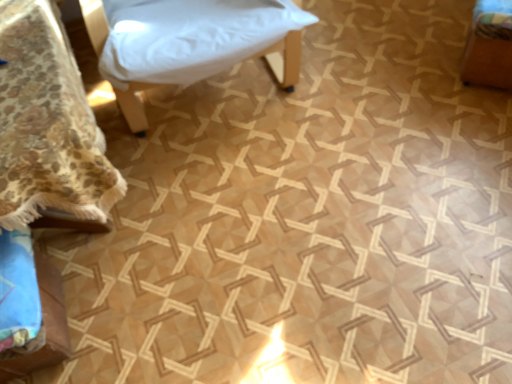
What is the approximate height of floral fabric bedspread at lower left, which ranks as the first furniture in left-to-right order?

It is 24.24 inches.

Measure the distance between wooden box at right, which appears as the first furniture when viewed from the right, and camera.

wooden box at right, which appears as the first furniture when viewed from the right, and camera are 1.35 meters apart.

What is the approximate height of blue fabric cushion at lower left, which is the 2th furniture from left to right?

35.86 centimeters.

Identify the location of floral fabric bedspread at lower left, arranged as the fourth furniture when viewed from the right. The image size is (512, 384). (47, 123).

Who is bigger, wooden box at right, which appears as the first furniture when viewed from the right, or white fabric cushion at upper center, which is counted as the second furniture, starting from the right?

white fabric cushion at upper center, which is counted as the second furniture, starting from the right.

How many degrees apart are the facing directions of wooden box at right, acting as the 4th furniture starting from the left, and white fabric cushion at upper center, acting as the third furniture starting from the left?

wooden box at right, acting as the 4th furniture starting from the left, and white fabric cushion at upper center, acting as the third furniture starting from the left, are facing 38.2 degrees away from each other.

Is wooden box at right, acting as the 4th furniture starting from the left, shorter than white fabric cushion at upper center, acting as the third furniture starting from the left?

Indeed, wooden box at right, acting as the 4th furniture starting from the left, has a lesser height compared to white fabric cushion at upper center, acting as the third furniture starting from the left.

Is wooden box at right, which appears as the first furniture when viewed from the right, wider than white fabric cushion at upper center, acting as the third furniture starting from the left?

In fact, wooden box at right, which appears as the first furniture when viewed from the right, might be narrower than white fabric cushion at upper center, acting as the third furniture starting from the left.

From the picture: Does white fabric cushion at upper center, acting as the third furniture starting from the left, turn towards wooden box at right, which appears as the first furniture when viewed from the right?

No, white fabric cushion at upper center, acting as the third furniture starting from the left, is not turned towards wooden box at right, which appears as the first furniture when viewed from the right.

Choose the correct answer: Is white fabric cushion at upper center, which is counted as the second furniture, starting from the right, inside wooden box at right, which appears as the first furniture when viewed from the right, or outside it?

white fabric cushion at upper center, which is counted as the second furniture, starting from the right, lies outside wooden box at right, which appears as the first furniture when viewed from the right.

From a real-world perspective, which object rests below the other?

In real-world perspective, wooden box at right, which appears as the first furniture when viewed from the right, is lower.

Which is in front, point (144, 116) or point (479, 64)?

The point (479, 64) is more forward.

From a real-world perspective, which is physically below, white fabric cushion at upper center, acting as the third furniture starting from the left, or blue fabric cushion at lower left, the 3th furniture from the right?

blue fabric cushion at lower left, the 3th furniture from the right, is physically lower.

Is white fabric cushion at upper center, which is counted as the second furniture, starting from the right, positioned with its back to blue fabric cushion at lower left, the 3th furniture from the right?

That's not correct — white fabric cushion at upper center, which is counted as the second furniture, starting from the right, is not looking away from blue fabric cushion at lower left, the 3th furniture from the right.

Considering the sizes of objects white fabric cushion at upper center, acting as the third furniture starting from the left, and blue fabric cushion at lower left, which is the 2th furniture from left to right, in the image provided, who is wider, white fabric cushion at upper center, acting as the third furniture starting from the left, or blue fabric cushion at lower left, which is the 2th furniture from left to right,?

Wider between the two is white fabric cushion at upper center, acting as the third furniture starting from the left.

Identify the location of the 2nd furniture to the left of the wooden box at right, acting as the 4th furniture starting from the left, counting from the anchor's position. The width and height of the screenshot is (512, 384). (45, 324).

Which is in front, blue fabric cushion at lower left, the 3th furniture from the right, or wooden box at right, which appears as the first furniture when viewed from the right?

blue fabric cushion at lower left, the 3th furniture from the right, is more forward.

From a real-world perspective, is blue fabric cushion at lower left, which is the 2th furniture from left to right, physically above wooden box at right, which appears as the first furniture when viewed from the right?

Actually, blue fabric cushion at lower left, which is the 2th furniture from left to right, is physically below wooden box at right, which appears as the first furniture when viewed from the right, in the real world.

Where is `furniture that is the 2nd object to the left of the wooden box at right, acting as the 4th furniture starting from the left, starting at the anchor`? Image resolution: width=512 pixels, height=384 pixels. furniture that is the 2nd object to the left of the wooden box at right, acting as the 4th furniture starting from the left, starting at the anchor is located at coordinates (45, 324).

From a real-world perspective, relative to blue fabric cushion at lower left, the 3th furniture from the right, is wooden box at right, acting as the 4th furniture starting from the left, vertically above or below?

wooden box at right, acting as the 4th furniture starting from the left, is above blue fabric cushion at lower left, the 3th furniture from the right.

Considering the positions of objects wooden box at right, acting as the 4th furniture starting from the left, and blue fabric cushion at lower left, the 3th furniture from the right, in the image provided, who is in front, wooden box at right, acting as the 4th furniture starting from the left, or blue fabric cushion at lower left, the 3th furniture from the right,?

blue fabric cushion at lower left, the 3th furniture from the right, is closer to the camera.

Considering the sizes of objects floral fabric bedspread at lower left, arranged as the fourth furniture when viewed from the right, and white fabric cushion at upper center, which is counted as the second furniture, starting from the right, in the image provided, who is smaller, floral fabric bedspread at lower left, arranged as the fourth furniture when viewed from the right, or white fabric cushion at upper center, which is counted as the second furniture, starting from the right,?

With smaller size is floral fabric bedspread at lower left, arranged as the fourth furniture when viewed from the right.

Is floral fabric bedspread at lower left, which ranks as the first furniture in left-to-right order, shorter than white fabric cushion at upper center, acting as the third furniture starting from the left?

Yes, floral fabric bedspread at lower left, which ranks as the first furniture in left-to-right order, is shorter than white fabric cushion at upper center, acting as the third furniture starting from the left.

In the image, is floral fabric bedspread at lower left, arranged as the fourth furniture when viewed from the right, positioned in front of or behind white fabric cushion at upper center, acting as the third furniture starting from the left?

Clearly, floral fabric bedspread at lower left, arranged as the fourth furniture when viewed from the right, is in front of white fabric cushion at upper center, acting as the third furniture starting from the left.

Is floral fabric bedspread at lower left, arranged as the fourth furniture when viewed from the right, turned away from white fabric cushion at upper center, acting as the third furniture starting from the left?

No, white fabric cushion at upper center, acting as the third furniture starting from the left, is not at the back of floral fabric bedspread at lower left, arranged as the fourth furniture when viewed from the right.

From a real-world perspective, is blue fabric cushion at lower left, the 3th furniture from the right, below white fabric cushion at upper center, acting as the third furniture starting from the left?

Yes.

Is blue fabric cushion at lower left, the 3th furniture from the right, turned away from white fabric cushion at upper center, acting as the third furniture starting from the left?

No, blue fabric cushion at lower left, the 3th furniture from the right, is not facing away from white fabric cushion at upper center, acting as the third furniture starting from the left.

Consider the image. Is blue fabric cushion at lower left, which is the 2th furniture from left to right, surrounding white fabric cushion at upper center, which is counted as the second furniture, starting from the right?

No, white fabric cushion at upper center, which is counted as the second furniture, starting from the right, is located outside of blue fabric cushion at lower left, which is the 2th furniture from left to right.

Is the surface of blue fabric cushion at lower left, which is the 2th furniture from left to right, in direct contact with white fabric cushion at upper center, which is counted as the second furniture, starting from the right?

No, blue fabric cushion at lower left, which is the 2th furniture from left to right, is not beside white fabric cushion at upper center, which is counted as the second furniture, starting from the right.

Find the location of `the 1st furniture to the left of the wooden box at right, acting as the 4th furniture starting from the left, starting your count from the anchor`. the 1st furniture to the left of the wooden box at right, acting as the 4th furniture starting from the left, starting your count from the anchor is located at coordinates (189, 42).

This screenshot has width=512, height=384. I want to click on furniture on the right of white fabric cushion at upper center, acting as the third furniture starting from the left, so tap(489, 45).

When comparing their distances from wooden box at right, acting as the 4th furniture starting from the left, does blue fabric cushion at lower left, which is the 2th furniture from left to right, or floral fabric bedspread at lower left, arranged as the fourth furniture when viewed from the right, seem closer?

floral fabric bedspread at lower left, arranged as the fourth furniture when viewed from the right.

Estimate the real-world distances between objects in this image. Which object is closer to floral fabric bedspread at lower left, arranged as the fourth furniture when viewed from the right, wooden box at right, acting as the 4th furniture starting from the left, or white fabric cushion at upper center, acting as the third furniture starting from the left?

The object closer to floral fabric bedspread at lower left, arranged as the fourth furniture when viewed from the right, is white fabric cushion at upper center, acting as the third furniture starting from the left.

Considering their positions, is floral fabric bedspread at lower left, which ranks as the first furniture in left-to-right order, positioned further to wooden box at right, acting as the 4th furniture starting from the left, than white fabric cushion at upper center, which is counted as the second furniture, starting from the right?

floral fabric bedspread at lower left, which ranks as the first furniture in left-to-right order.

Estimate the real-world distances between objects in this image. Which object is further from floral fabric bedspread at lower left, which ranks as the first furniture in left-to-right order, wooden box at right, which appears as the first furniture when viewed from the right, or blue fabric cushion at lower left, which is the 2th furniture from left to right?

wooden box at right, which appears as the first furniture when viewed from the right, is further to floral fabric bedspread at lower left, which ranks as the first furniture in left-to-right order.

Based on their spatial positions, is wooden box at right, acting as the 4th furniture starting from the left, or floral fabric bedspread at lower left, arranged as the fourth furniture when viewed from the right, closer to white fabric cushion at upper center, which is counted as the second furniture, starting from the right?

floral fabric bedspread at lower left, arranged as the fourth furniture when viewed from the right.

Looking at the image, which one is located further to floral fabric bedspread at lower left, which ranks as the first furniture in left-to-right order, blue fabric cushion at lower left, which is the 2th furniture from left to right, or white fabric cushion at upper center, which is counted as the second furniture, starting from the right?

white fabric cushion at upper center, which is counted as the second furniture, starting from the right.

When comparing their distances from blue fabric cushion at lower left, which is the 2th furniture from left to right, does floral fabric bedspread at lower left, which ranks as the first furniture in left-to-right order, or wooden box at right, acting as the 4th furniture starting from the left, seem further?

wooden box at right, acting as the 4th furniture starting from the left.

Estimate the real-world distances between objects in this image. Which object is further from white fabric cushion at upper center, which is counted as the second furniture, starting from the right, blue fabric cushion at lower left, the 3th furniture from the right, or floral fabric bedspread at lower left, which ranks as the first furniture in left-to-right order?

blue fabric cushion at lower left, the 3th furniture from the right, is further to white fabric cushion at upper center, which is counted as the second furniture, starting from the right.

The height and width of the screenshot is (384, 512). Find the location of `furniture situated between blue fabric cushion at lower left, the 3th furniture from the right, and wooden box at right, which appears as the first furniture when viewed from the right, from left to right`. furniture situated between blue fabric cushion at lower left, the 3th furniture from the right, and wooden box at right, which appears as the first furniture when viewed from the right, from left to right is located at coordinates (189, 42).